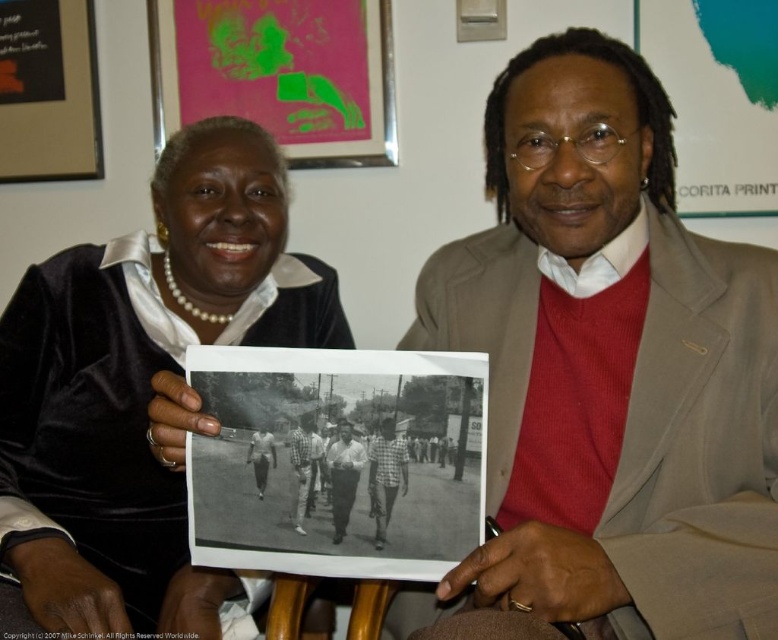
Question: Can you confirm if matte gray blazer at center is positioned to the left of plaid shirt at center?

Choices:
 (A) yes
 (B) no

Answer: (B)

Question: Can you confirm if velvet black dress at center is thinner than checkered fabric shirt at center?

Choices:
 (A) yes
 (B) no

Answer: (B)

Question: Can you confirm if matte gray blazer at center is thinner than checkered fabric shirt at center?

Choices:
 (A) yes
 (B) no

Answer: (B)

Question: Which of these objects is positioned farthest from the matte gray blazer at center?

Choices:
 (A) white cotton shirt at center
 (B) checkered fabric shirt at center

Answer: (A)

Question: Which point is closer to the camera taking this photo?

Choices:
 (A) (373, 461)
 (B) (340, 508)

Answer: (A)

Question: Which object appears closest to the camera in this image?

Choices:
 (A) checkered fabric shirt at center
 (B) light gray cotton shirt at center

Answer: (A)